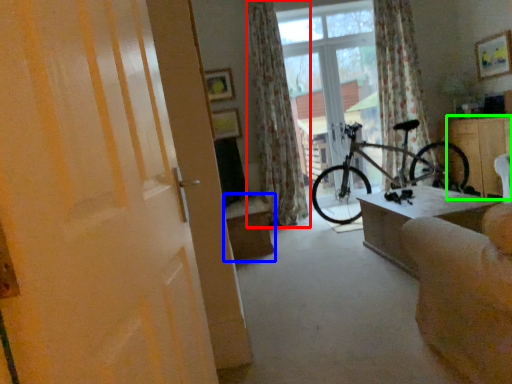
Question: Considering the real-world distances, which object is closest to curtain (highlighted by a red box)? table (highlighted by a blue box) or cabinetry (highlighted by a green box).

Choices:
 (A) table
 (B) cabinetry

Answer: (A)